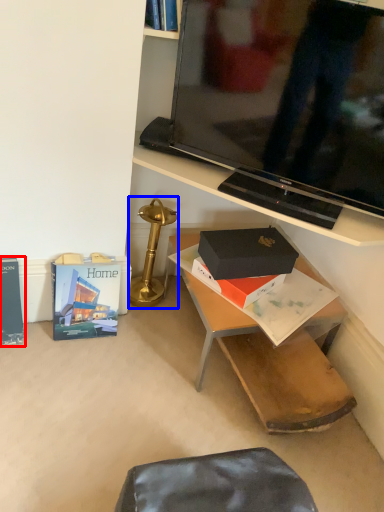
Question: Which point is further to the camera, paperback book (highlighted by a red box) or table lamp (highlighted by a blue box)?

Choices:
 (A) paperback book
 (B) table lamp

Answer: (B)